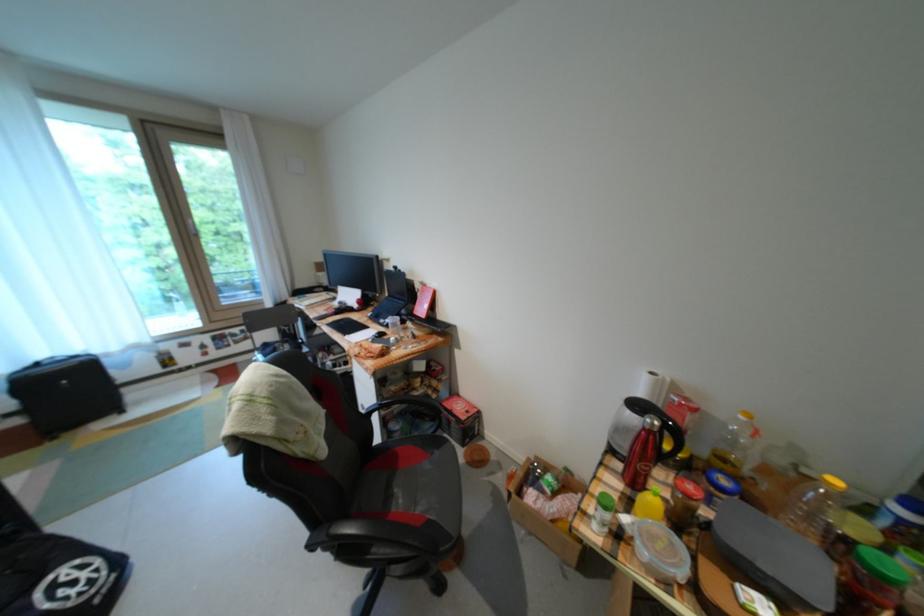
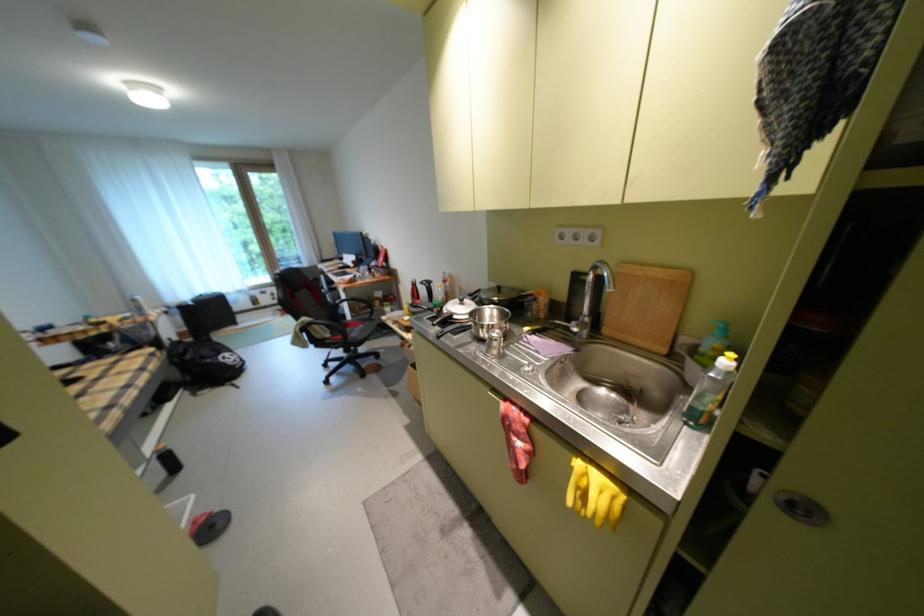
Locate, in the second image, the point that corresponds to (207,346) in the first image.

(280, 294)